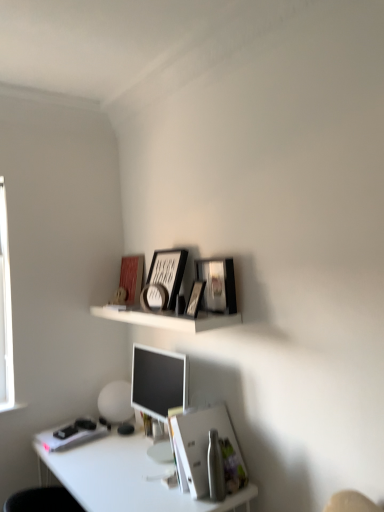
Question: Is white paper at lower center outside white glossy desk at lower left?

Choices:
 (A) yes
 (B) no

Answer: (A)

Question: Can you confirm if white paper at lower center is positioned to the right of white glossy desk at lower left?

Choices:
 (A) no
 (B) yes

Answer: (B)

Question: Can you confirm if white paper at lower center is smaller than white glossy desk at lower left?

Choices:
 (A) yes
 (B) no

Answer: (A)

Question: Can you confirm if white paper at lower center is thinner than white glossy desk at lower left?

Choices:
 (A) yes
 (B) no

Answer: (A)

Question: Is white paper at lower center at the left side of white glossy desk at lower left?

Choices:
 (A) no
 (B) yes

Answer: (A)

Question: From a real-world perspective, relative to matte black picture frame at upper center, acting as the third picture frame starting from the left, is white glossy desk at lower left vertically above or below?

Choices:
 (A) above
 (B) below

Answer: (B)

Question: Is white glossy desk at lower left taller or shorter than matte black picture frame at upper center, placed as the second picture frame when sorted from right to left?

Choices:
 (A) short
 (B) tall

Answer: (B)

Question: Is white glossy desk at lower left inside or outside of matte black picture frame at upper center, acting as the third picture frame starting from the left?

Choices:
 (A) outside
 (B) inside

Answer: (A)

Question: From the image's perspective, relative to matte black picture frame at upper center, acting as the third picture frame starting from the left, is white glossy desk at lower left above or below?

Choices:
 (A) above
 (B) below

Answer: (B)

Question: Is point (152, 305) closer or farther from the camera than point (193, 304)?

Choices:
 (A) closer
 (B) farther

Answer: (B)

Question: From a real-world perspective, is metallic silver picture frame at upper center, which is the 4th picture frame in right-to-left order, positioned above or below matte black picture frame at upper center, acting as the third picture frame starting from the left?

Choices:
 (A) below
 (B) above

Answer: (A)

Question: From the image's perspective, is metallic silver picture frame at upper center, which is the 4th picture frame in right-to-left order, above or below matte black picture frame at upper center, acting as the third picture frame starting from the left?

Choices:
 (A) above
 (B) below

Answer: (B)

Question: Based on their sizes in the image, would you say metallic silver picture frame at upper center, which appears as the first picture frame when viewed from the left, is bigger or smaller than matte black picture frame at upper center, placed as the second picture frame when sorted from right to left?

Choices:
 (A) small
 (B) big

Answer: (A)

Question: Is white paper at lower center bigger or smaller than matte black picture frame at upper center, acting as the third picture frame starting from the left?

Choices:
 (A) big
 (B) small

Answer: (A)

Question: Is white paper at lower center in front of or behind matte black picture frame at upper center, acting as the third picture frame starting from the left, in the image?

Choices:
 (A) behind
 (B) front

Answer: (B)